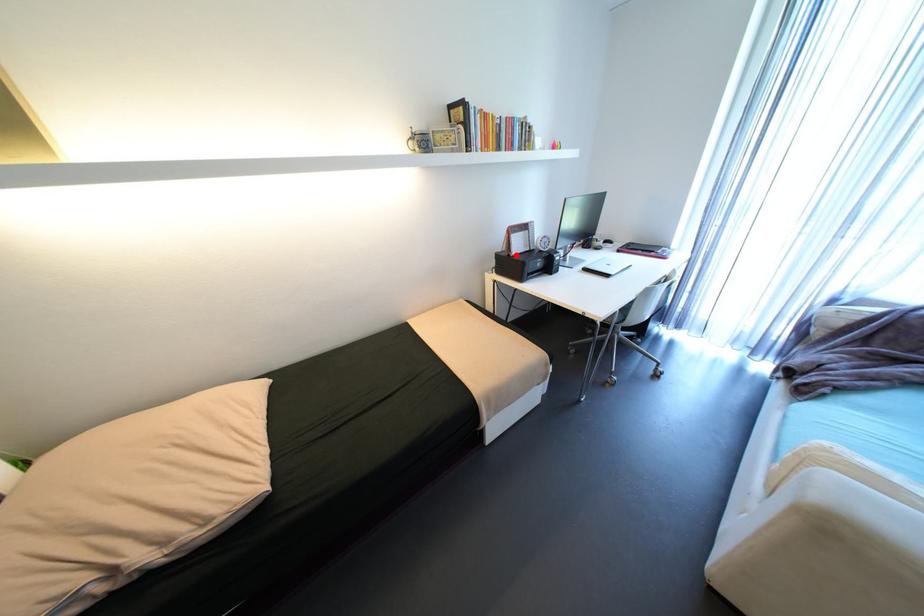
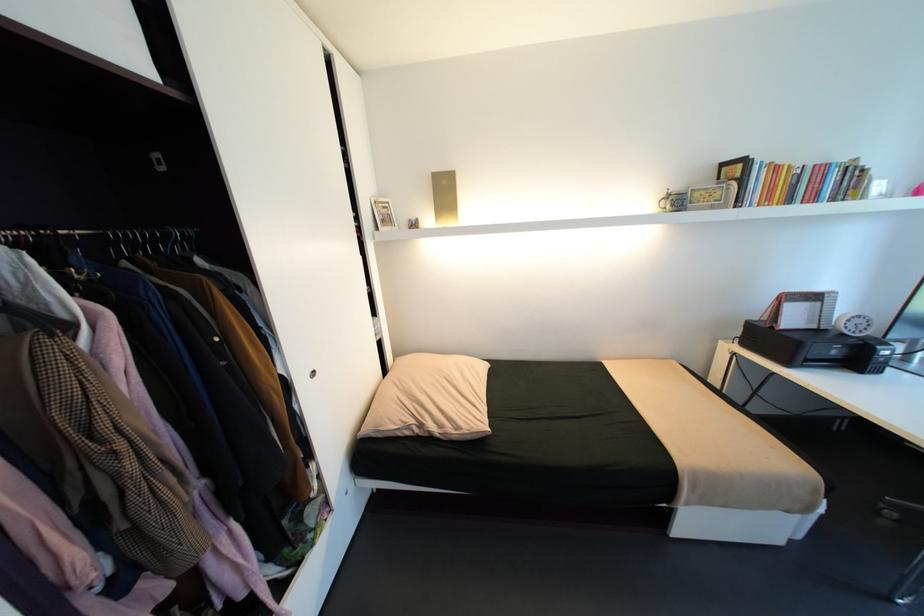
Find the pixel in the second image that matches the highlighted location in the first image.

(779, 328)